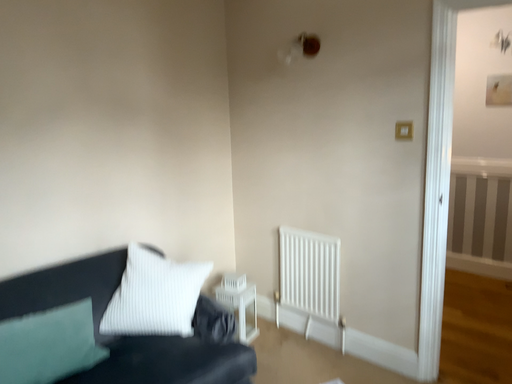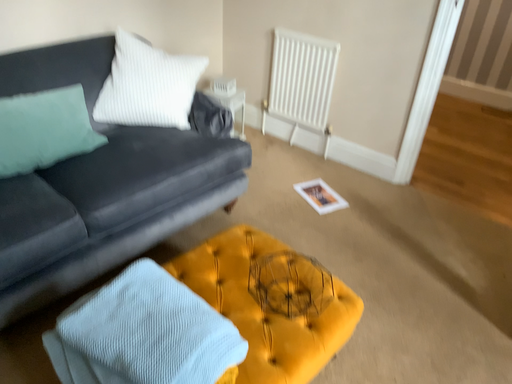
Question: Which way did the camera rotate in the video?

Choices:
 (A) rotated downward
 (B) rotated upward

Answer: (A)